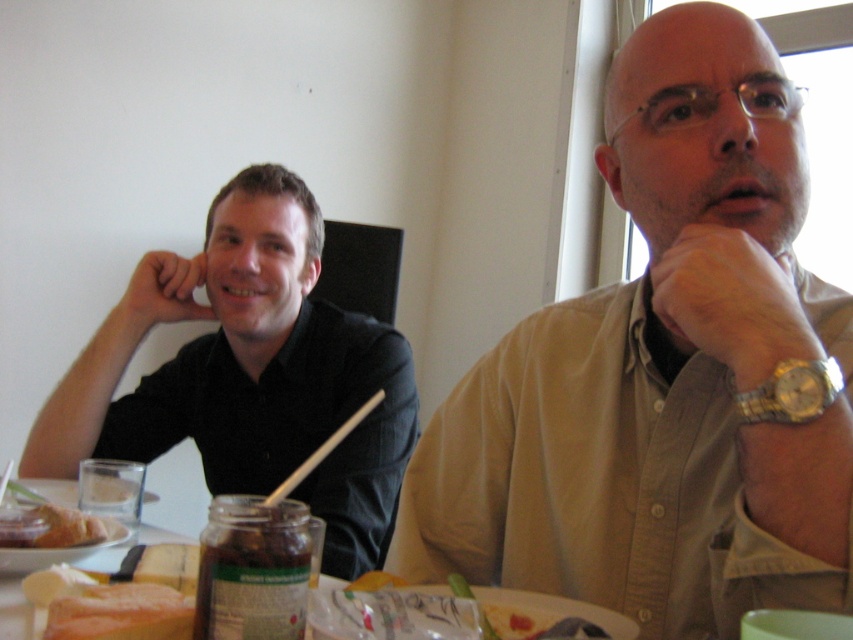
Based on the photo, can you confirm if light beige shirt at center is shorter than white wood chopstick at center?

Incorrect, light beige shirt at center's height does not fall short of white wood chopstick at center's.

Does light beige shirt at center have a larger size compared to white wood chopstick at center?

Indeed, light beige shirt at center has a larger size compared to white wood chopstick at center.

Is point (566, 429) closer to viewer compared to point (279, 492)?

No, (566, 429) is further to viewer.

Where is `light beige shirt at center`? Image resolution: width=853 pixels, height=640 pixels. light beige shirt at center is located at coordinates (660, 374).

Which is behind, point (128, 410) or point (799, 388)?

The point (128, 410) is more distant.

Does point (201, 268) lie behind point (756, 401)?

Yes, point (201, 268) is behind point (756, 401).

Locate an element on the screen. The image size is (853, 640). black matte shirt at left is located at coordinates (248, 372).

Is black matte shirt at left wider than golden bread at lower left?

Yes.

Between point (270, 232) and point (51, 545), which one is positioned in front?

Point (51, 545) is more forward.

Does point (349, 570) lie behind point (28, 540)?

Yes, it is behind point (28, 540).

The height and width of the screenshot is (640, 853). In order to click on black matte shirt at left in this screenshot , I will do `click(248, 372)`.